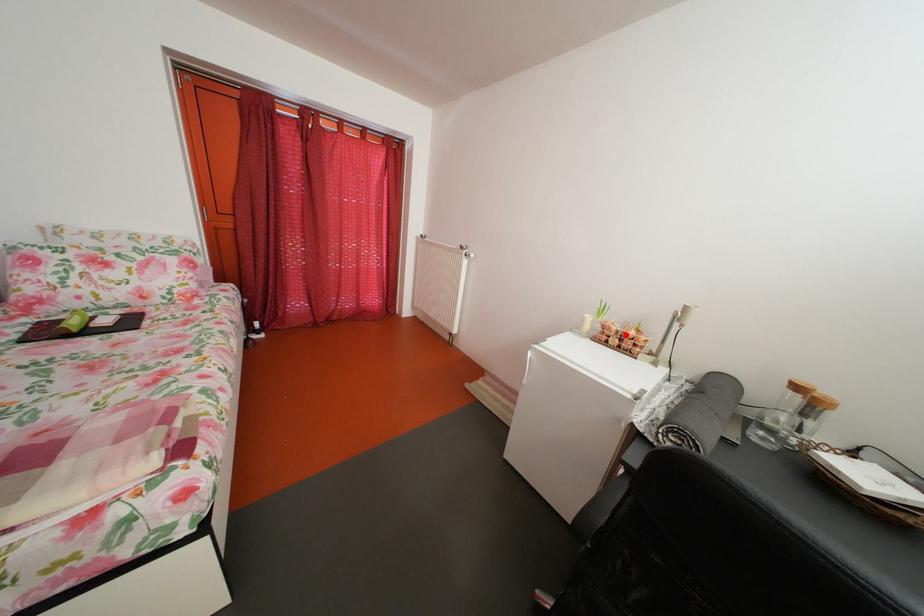
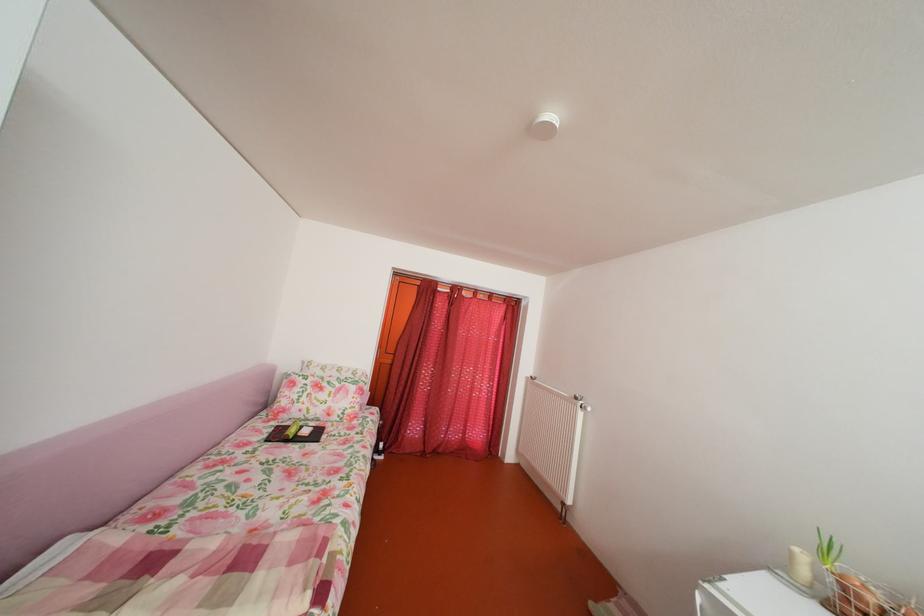
Question: A red point is marked in image1. In image2, is the corresponding 3D point closer to the camera or farther? Reply with the corresponding letter.

Choices:
 (A) The corresponding 3D point is closer.
 (B) The corresponding 3D point is farther.

Answer: (A)